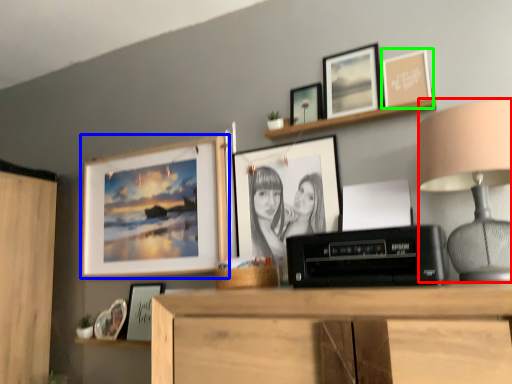
Question: Considering the real-world distances, which object is farthest from table lamp (highlighted by a red box)? picture frame (highlighted by a blue box) or picture frame (highlighted by a green box)?

Choices:
 (A) picture frame
 (B) picture frame

Answer: (A)